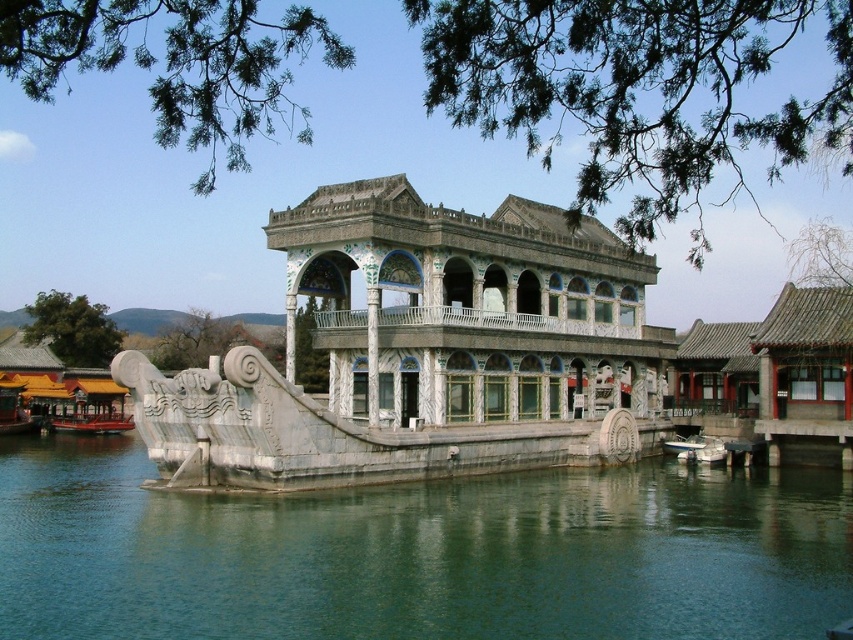
You are a visitor at the pavilion and want to take a photo of the shiny red boat at lower left. Since the green stone water at center is in the way, can you move the boat to the right to avoid the water? Explain your reasoning.

The green stone water at center is larger in size than the shiny red boat at lower left, so moving the boat to the right might not be possible due to the water being larger and possibly occupying more space, making it difficult to maneuver around.

You are a tourist visiting the pavilion and want to take a photo of the white marble palace at center. Since you want the green stone water at center to be visible in the background, can you stand in a position where both are in the frame?

The green stone water at center is positioned under the white marble palace at center, so you can stand in front of the white marble palace at center and tilt your camera upwards to include both the palace and the water beneath it in the same frame.

Consider the image. You are standing on the deck of the shiny red boat at lower left and want to jump into the water. Which direction should you jump to reach the green stone water at center?

You should jump downward because the green stone water at center is below the shiny red boat at lower left.